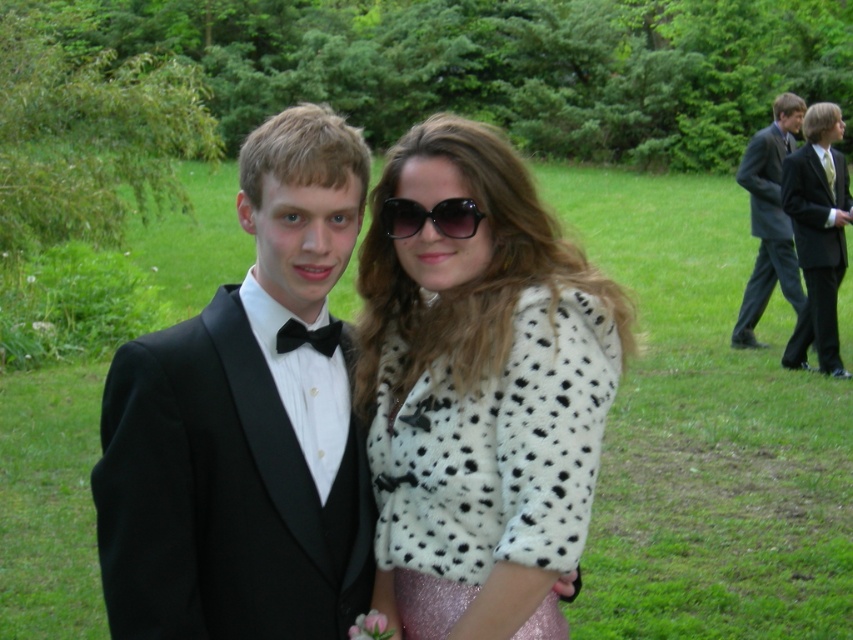
You are a photographer at a formal event. You want to capture a wide shot that includes both the black satin tuxedo at left and the dark gray suit at right. The camera you are using has a maximum focus range of 10 meters. Will you be able to fit both subjects into the frame without moving closer?

The distance between the black satin tuxedo at left and the dark gray suit at right is 9.38 meters, which is within the camera maximum focus range of 10 meters. Therefore, you can fit both subjects into the frame without moving closer.

You are a photographer at a formal event. You need to adjust the lighting so that both the black satin suit at right and the black plastic sunglasses at center are well lit. Which object is closer to the right side of the frame?

The black satin suit at right is positioned on the right side of the black plastic sunglasses at center, so the black satin suit at right is closer to the right side of the frame.